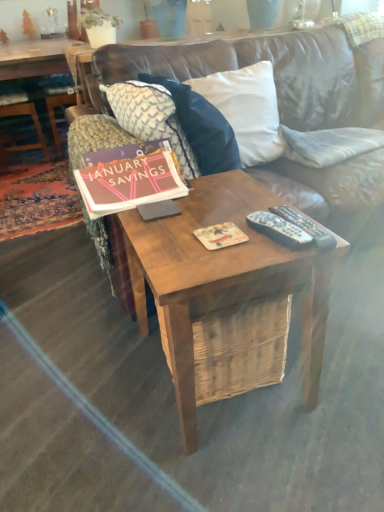
Where is `free spot to the left of woven brown basket at center`? The image size is (384, 512). free spot to the left of woven brown basket at center is located at coordinates (115, 385).